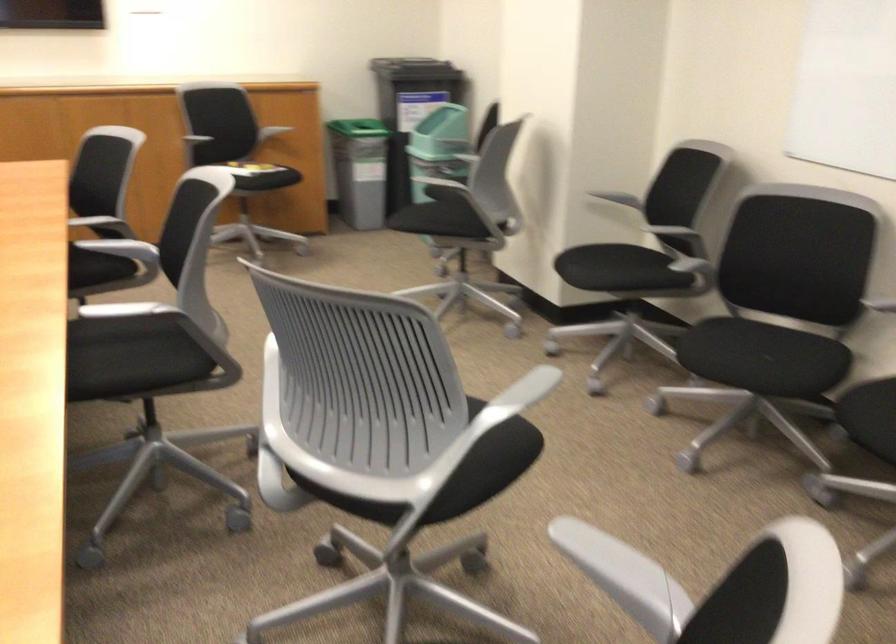
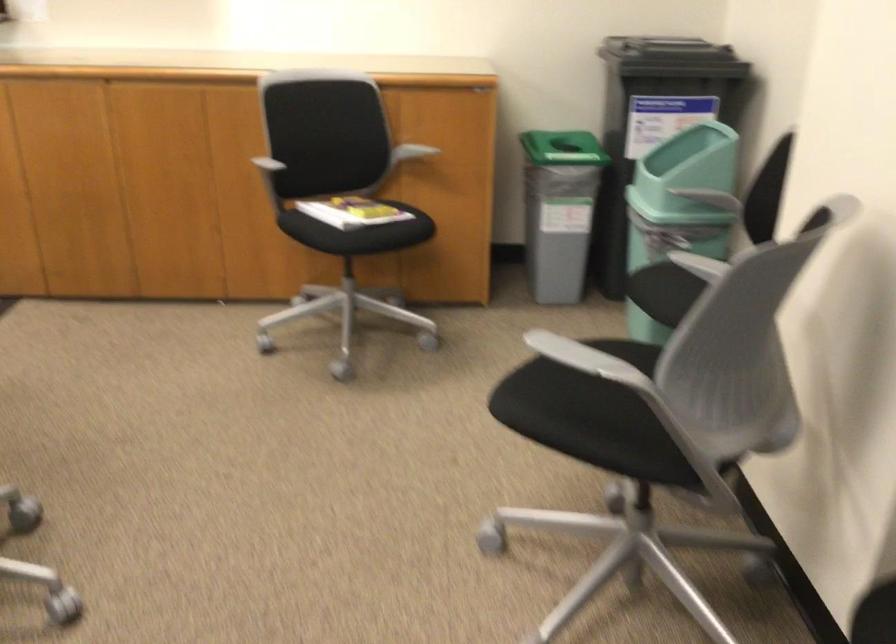
Locate, in the second image, the point that corresponds to point 253,151 in the first image.

(355, 212)